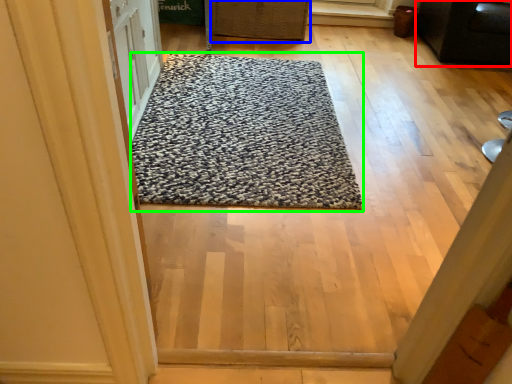
Question: Estimate the real-world distances between objects in this image. Which object is farther from furniture (highlighted by a red box), basket (highlighted by a blue box) or mat (highlighted by a green box)?

Choices:
 (A) basket
 (B) mat

Answer: (B)